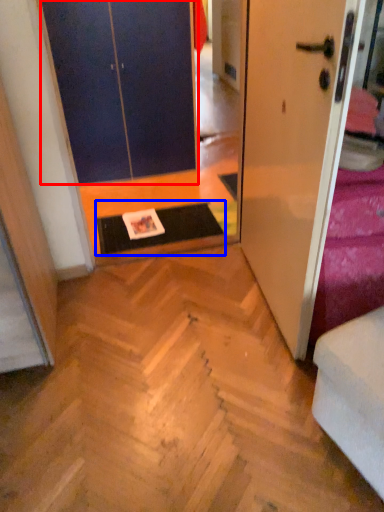
Question: Which object is closer to the camera taking this photo, door (highlighted by a red box) or doormat (highlighted by a blue box)?

Choices:
 (A) door
 (B) doormat

Answer: (B)